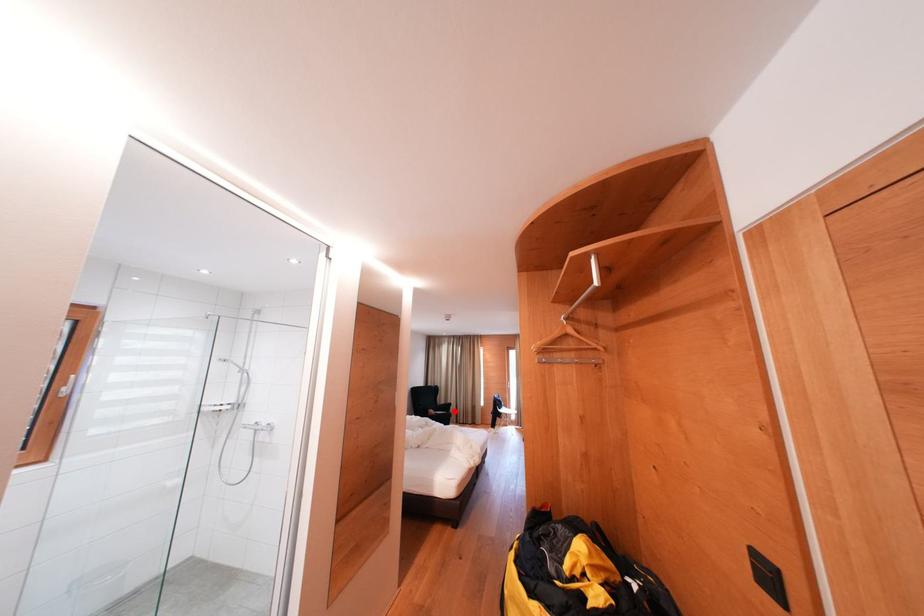
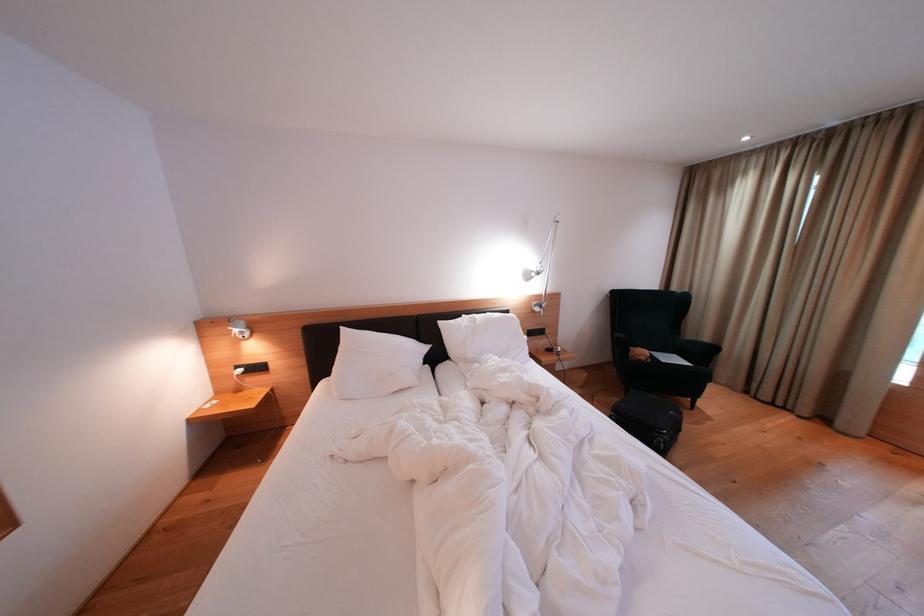
Question: I am providing you with two images of the same scene from different viewpoints. A red point is marked on the first image. Is the red point's position out of view in image 2?

Choices:
 (A) Yes
 (B) No

Answer: (B)